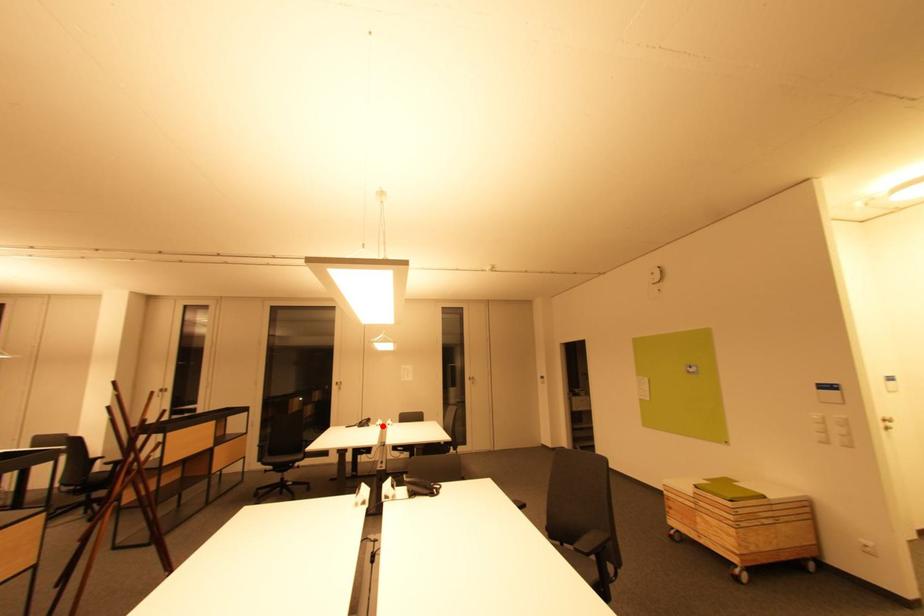
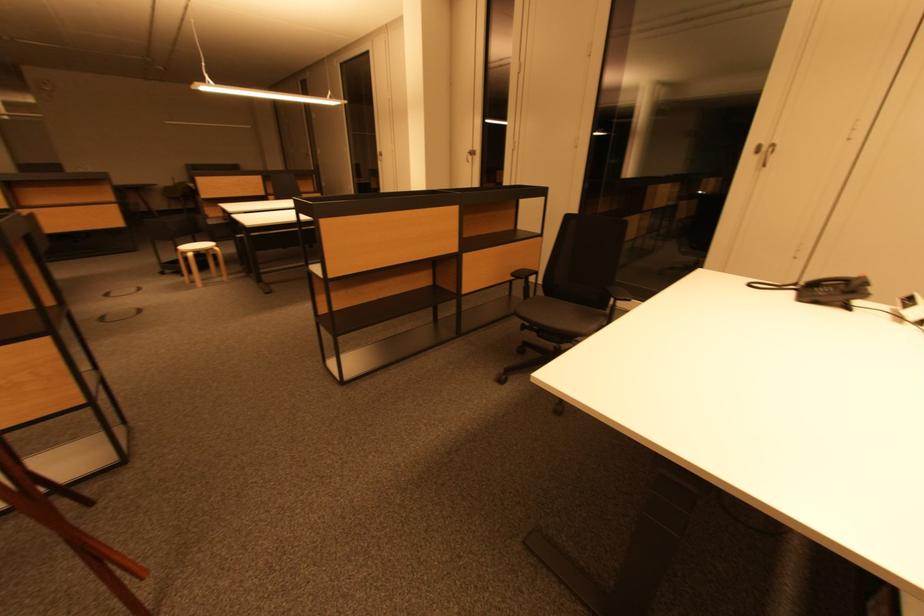
Question: A red point is marked in image1. In image2, is the corresponding 3D point closer to the camera or farther? Reply with the corresponding letter.

Choices:
 (A) The corresponding 3D point is closer.
 (B) The corresponding 3D point is farther.

Answer: (A)